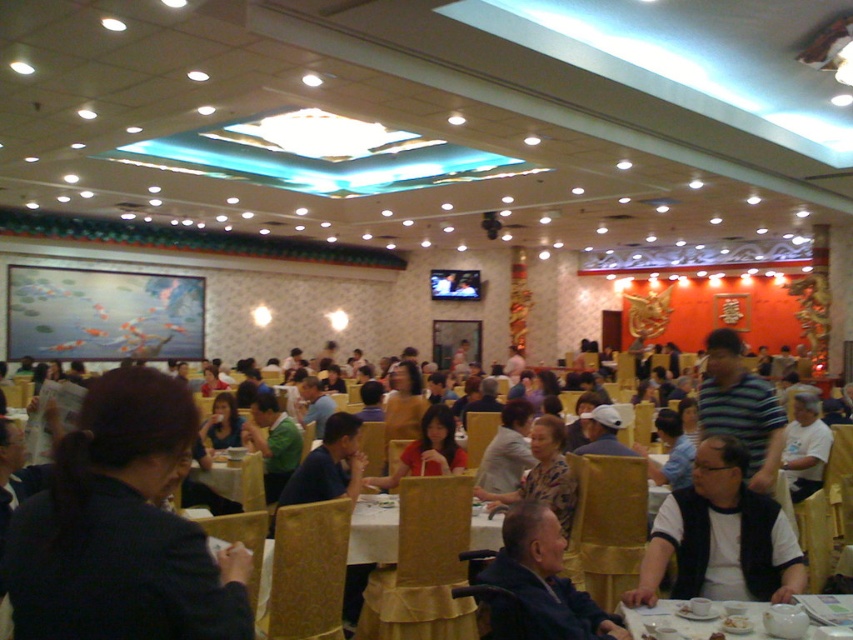
You are a guest at a banquet and notice a dark blue fabric at center. Where exactly is it located in the room?

The dark blue fabric at center is located at point 0.827 on the x axis and 0.144 on the y axis.

You are a guest at a banquet and see the dark blue shirt at center and the wooden table at center. Which object is positioned to the right side from your perspective?

The dark blue shirt at center is to the right of the wooden table at center, so the dark blue shirt at center is positioned to the right side from your perspective.

You are a photographer standing in the dining area and want to capture both the dark blue shirt at center and the wooden table at center in a single photo. Given their sizes, which object should you focus on to ensure both are clearly visible?

Since the dark blue shirt at center is smaller than the wooden table at center, you should focus on the wooden table at center to ensure both are clearly visible in the photo.